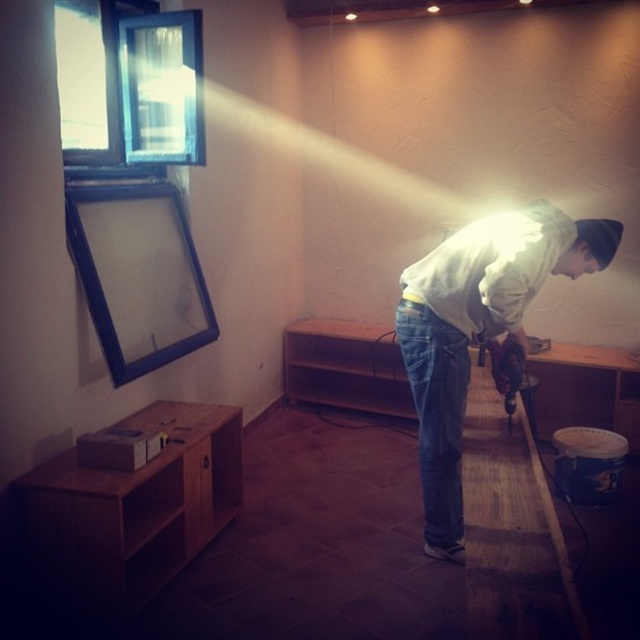
Question: Considering the relative positions of white matte shirt at center and denim jeans at center in the image provided, where is white matte shirt at center located with respect to denim jeans at center?

Choices:
 (A) left
 (B) right

Answer: (B)

Question: Which of the following is the farthest from the observer?

Choices:
 (A) (417, 356)
 (B) (509, 369)
 (C) (448, 465)

Answer: (C)

Question: Where is white matte shirt at center located in relation to metallic drill at lower center in the image?

Choices:
 (A) right
 (B) left

Answer: (B)

Question: Which object appears farthest from the camera in this image?

Choices:
 (A) white matte shirt at center
 (B) denim jeans at center

Answer: (B)

Question: Does denim jeans at center come behind metallic drill at lower center?

Choices:
 (A) no
 (B) yes

Answer: (A)

Question: Which object appears closest to the camera in this image?

Choices:
 (A) white matte shirt at center
 (B) denim jeans at center
 (C) metallic drill at lower center

Answer: (A)